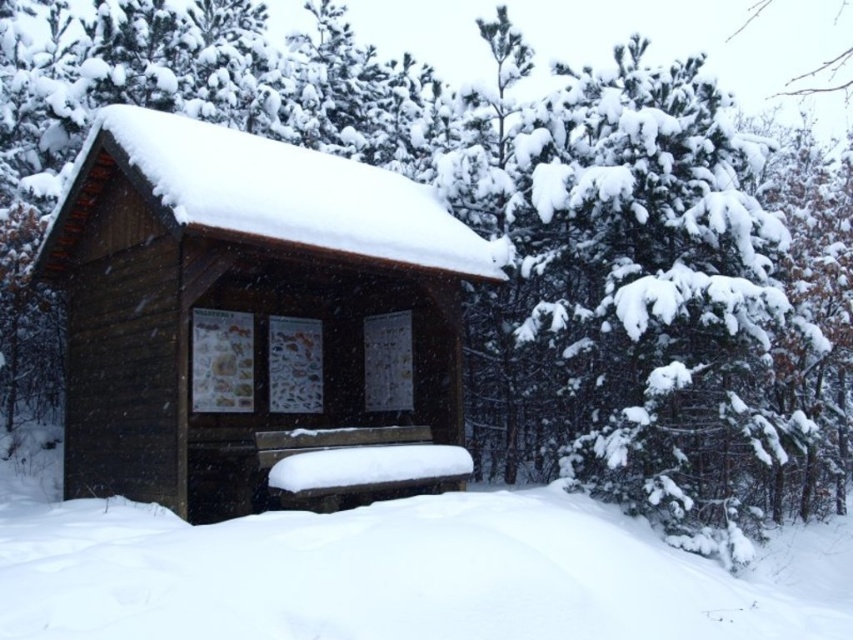
Does point (202, 465) come closer to viewer compared to point (45, 632)?

That is False.

Who is more forward, [482,253] or [309,561]?

Point [309,561]

Who is more forward, [202,156] or [4,513]?

Point [4,513] is in front.

Identify the location of wooden log cabin at center. This screenshot has width=853, height=640. (248, 314).